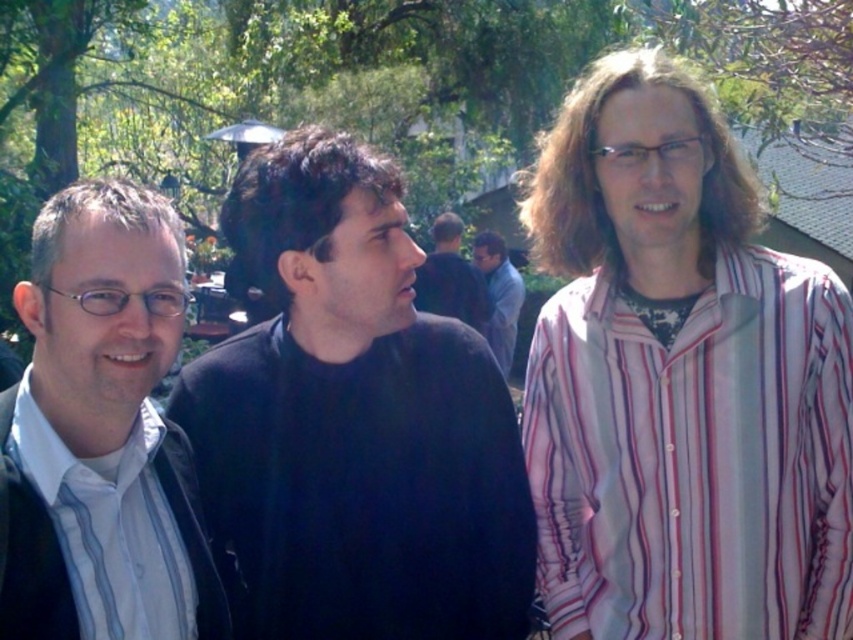
Question: Which point is closer to the camera?

Choices:
 (A) (68, 404)
 (B) (511, 564)
 (C) (614, 284)

Answer: (A)

Question: Can you confirm if black matte sweater at center is positioned below black matte shirt at center?

Choices:
 (A) yes
 (B) no

Answer: (A)

Question: Which point appears closest to the camera in this image?

Choices:
 (A) (659, 429)
 (B) (480, 288)
 (C) (345, 545)
 (D) (45, 545)

Answer: (D)

Question: Does white matte shirt at left have a greater width compared to dark blue sweater at center?

Choices:
 (A) yes
 (B) no

Answer: (B)

Question: Which point is farther to the camera?

Choices:
 (A) black matte sweater at center
 (B) white striped shirt at left
 (C) black matte shirt at center
 (D) dark blue sweater at center

Answer: (D)

Question: Is black matte sweater at center bigger than striped cotton shirt at right?

Choices:
 (A) no
 (B) yes

Answer: (B)